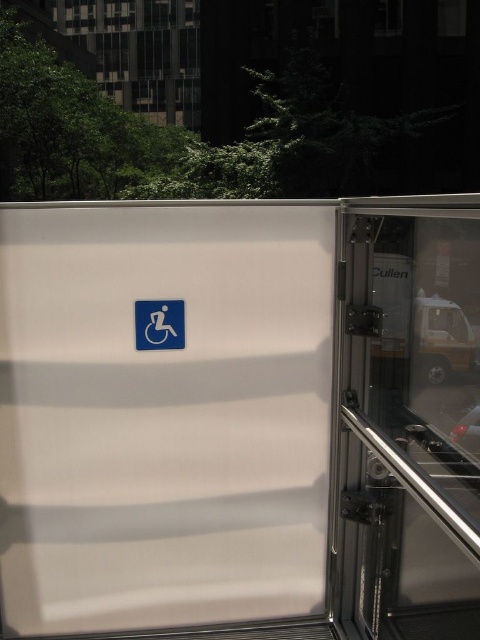
Consider the image. Which is below, white matte screen door at center or transparent glass screen door at right?

transparent glass screen door at right is lower down.

Is white matte screen door at center closer to camera compared to transparent glass screen door at right?

No, white matte screen door at center is behind transparent glass screen door at right.

Between point (222, 250) and point (402, 566), which one is positioned behind?

The point (222, 250) is more distant.

I want to click on white matte screen door at center, so click(x=164, y=413).

Can you confirm if white matte screen door at center is positioned to the right of blue plastic sign at center?

Yes, white matte screen door at center is to the right of blue plastic sign at center.

Is point (100, 365) less distant than point (137, 321)?

That is True.

Is point (86, 337) positioned after point (151, 346)?

No, (86, 337) is in front of (151, 346).

Find the location of a particular element. white matte screen door at center is located at coordinates (164, 413).

Does transparent glass screen door at right have a greater height compared to blue plastic sign at center?

Correct, transparent glass screen door at right is much taller as blue plastic sign at center.

Who is taller, transparent glass screen door at right or blue plastic sign at center?

Standing taller between the two is transparent glass screen door at right.

The image size is (480, 640). What are the coordinates of `transparent glass screen door at right` in the screenshot? It's located at (409, 417).

You are a GUI agent. You are given a task and a screenshot of the screen. Output one action in this format:
    pyautogui.click(x=<x>, y=<y>)
    Task: Click on the transparent glass screen door at right
    The height and width of the screenshot is (640, 480).
    Given the screenshot: What is the action you would take?
    pyautogui.click(x=409, y=417)